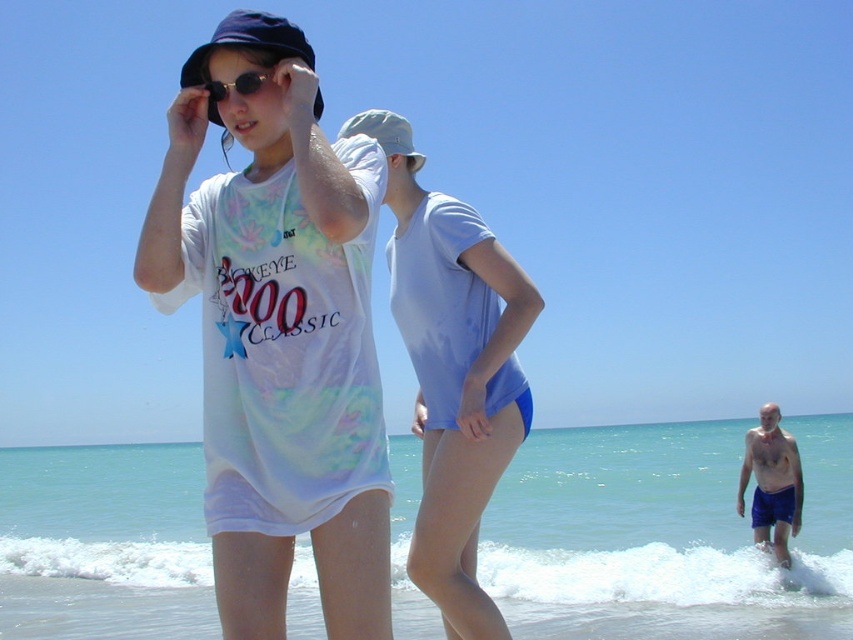
Between light blue swimsuit at center and smooth blue shorts at lower right, which one is positioned higher?

light blue swimsuit at center is above.

Does light blue swimsuit at center appear under smooth blue shorts at lower right?

Actually, light blue swimsuit at center is above smooth blue shorts at lower right.

Who is more distant from viewer, (511, 324) or (770, 502)?

Positioned behind is point (770, 502).

You are a GUI agent. You are given a task and a screenshot of the screen. Output one action in this format:
    pyautogui.click(x=<x>, y=<y>)
    Task: Click on the light blue swimsuit at center
    The height and width of the screenshot is (640, 853).
    Given the screenshot: What is the action you would take?
    pyautogui.click(x=453, y=371)

Measure the distance between point (416, 285) and camera.

Point (416, 285) is 5.11 meters from camera.

Does point (535, 305) come farther from viewer compared to point (218, 83)?

Yes, it is.

Is point (515, 326) farther from viewer compared to point (258, 84)?

Yes, it is.

Identify the location of light blue swimsuit at center. The width and height of the screenshot is (853, 640). (453, 371).

Who is shorter, smooth blue shorts at lower right or sunglasses at center?

sunglasses at center

Locate an element on the screen. Image resolution: width=853 pixels, height=640 pixels. smooth blue shorts at lower right is located at coordinates (770, 483).

You are a GUI agent. You are given a task and a screenshot of the screen. Output one action in this format:
    pyautogui.click(x=<x>, y=<y>)
    Task: Click on the smooth blue shorts at lower right
    This screenshot has height=640, width=853.
    Given the screenshot: What is the action you would take?
    pyautogui.click(x=770, y=483)

Find the location of a particular element. smooth blue shorts at lower right is located at coordinates (770, 483).